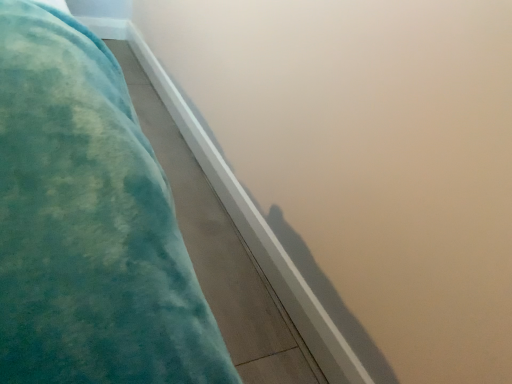
Where is `teal plush blanket at left`? teal plush blanket at left is located at coordinates (88, 223).

What do you see at coordinates (88, 223) in the screenshot?
I see `teal plush blanket at left` at bounding box center [88, 223].

You are a GUI agent. You are given a task and a screenshot of the screen. Output one action in this format:
    pyautogui.click(x=<x>, y=<y>)
    Task: Click on the teal plush blanket at left
    This screenshot has width=512, height=384.
    Given the screenshot: What is the action you would take?
    pyautogui.click(x=88, y=223)